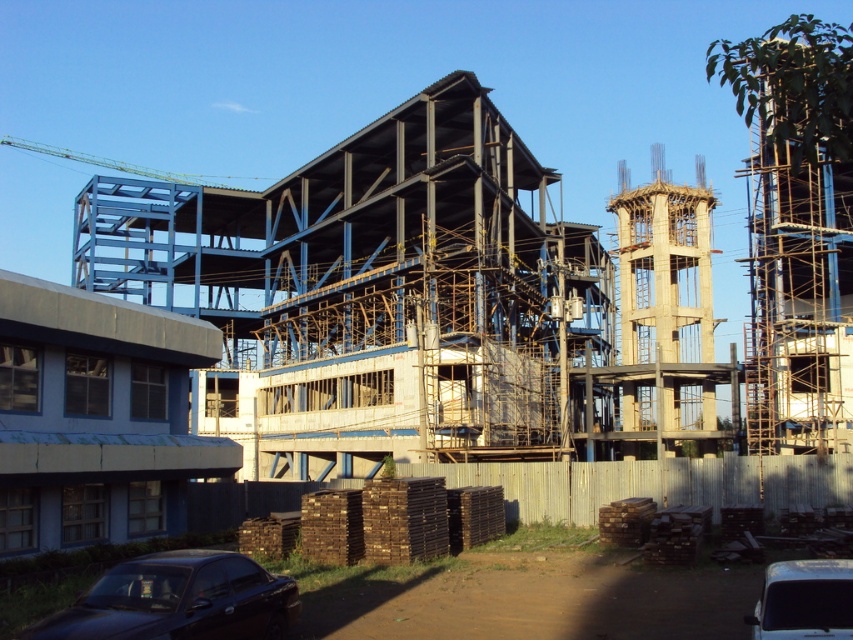
Question: Can you confirm if white matte van at lower right is smaller than metallic blue crane at upper left?

Choices:
 (A) yes
 (B) no

Answer: (A)

Question: Among these points, which one is nearest to the camera?

Choices:
 (A) (178, 180)
 (B) (248, 627)
 (C) (784, 621)

Answer: (C)

Question: Considering the real-world distances, which object is farthest from the shiny black car at lower left?

Choices:
 (A) white matte van at lower right
 (B) metallic blue crane at upper left

Answer: (B)

Question: Which object is positioned closest to the shiny black car at lower left?

Choices:
 (A) metallic blue crane at upper left
 (B) white matte van at lower right

Answer: (B)

Question: Can you confirm if white matte van at lower right is positioned above metallic blue crane at upper left?

Choices:
 (A) no
 (B) yes

Answer: (A)

Question: Does white matte van at lower right have a smaller size compared to metallic blue crane at upper left?

Choices:
 (A) yes
 (B) no

Answer: (A)